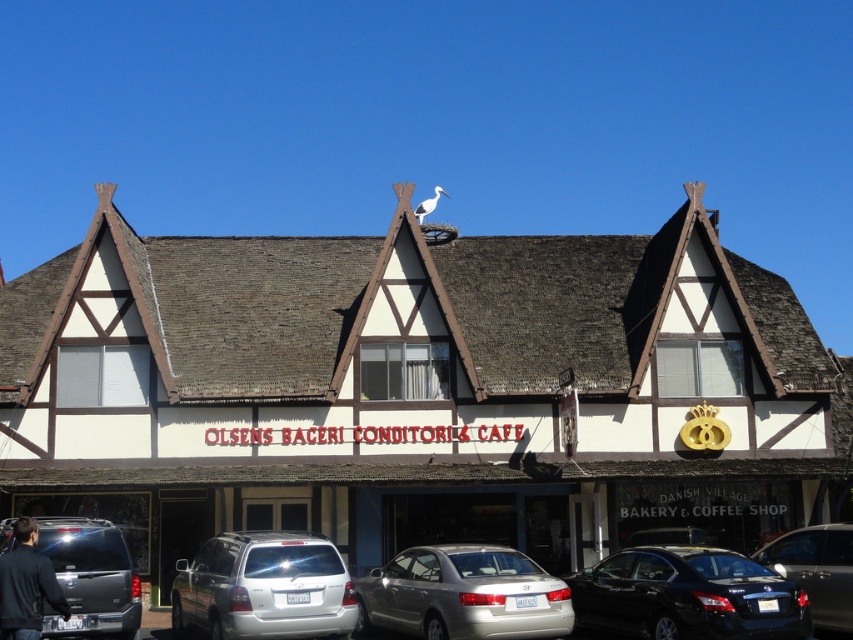
Consider the image. Between metallic gray suv at lower left and metallic silver sedan at lower right, which one appears on the left side from the viewer's perspective?

Positioned to the left is metallic gray suv at lower left.

Who is lower down, metallic gray suv at lower left or metallic silver sedan at lower right?

metallic silver sedan at lower right is below.

Between point (51, 621) and point (848, 608), which one is positioned in front?

Point (51, 621) is in front.

The height and width of the screenshot is (640, 853). I want to click on metallic gray suv at lower left, so click(x=90, y=577).

Is metallic silver car at lower center taller than metallic silver sedan at lower right?

Yes.

Does metallic silver car at lower center have a greater width compared to metallic silver sedan at lower right?

Indeed, metallic silver car at lower center has a greater width compared to metallic silver sedan at lower right.

Identify the location of metallic silver car at lower center. (90, 557).

From the picture: Who is positioned more to the left, white wood building at center or metallic gray suv at lower left?

metallic gray suv at lower left

Is white wood building at center above metallic gray suv at lower left?

Yes.

The image size is (853, 640). What are the coordinates of `white wood building at center` in the screenshot? It's located at (416, 388).